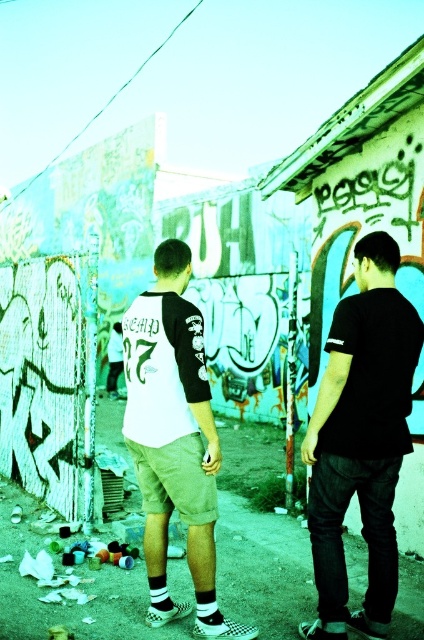
You are a photographer trying to capture the urban scene. You notice the black matte shirt at center and the white cotton shorts at center. Which clothing item is positioned higher on the person?

The black matte shirt at center is located above the white cotton shorts at center, so the black matte shirt at center is positioned higher.

You are a photographer trying to capture a closeup of the black matte shirt at center and white cotton shorts at center. Since you want to focus on the details of the shirt, which object should you adjust your camera to prioritize in the frame?

The black matte shirt at center has a smaller width than the white cotton shorts at center, so you should adjust your camera to prioritize the black matte shirt at center to ensure its details are captured clearly.